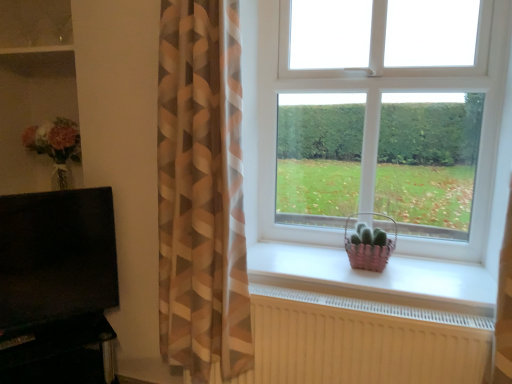
You are a GUI agent. You are given a task and a screenshot of the screen. Output one action in this format:
    pyautogui.click(x=<x>, y=<y>)
    Task: Click on the vacant space to the left of pink woven basket at window
    
    Given the screenshot: What is the action you would take?
    (x=317, y=259)